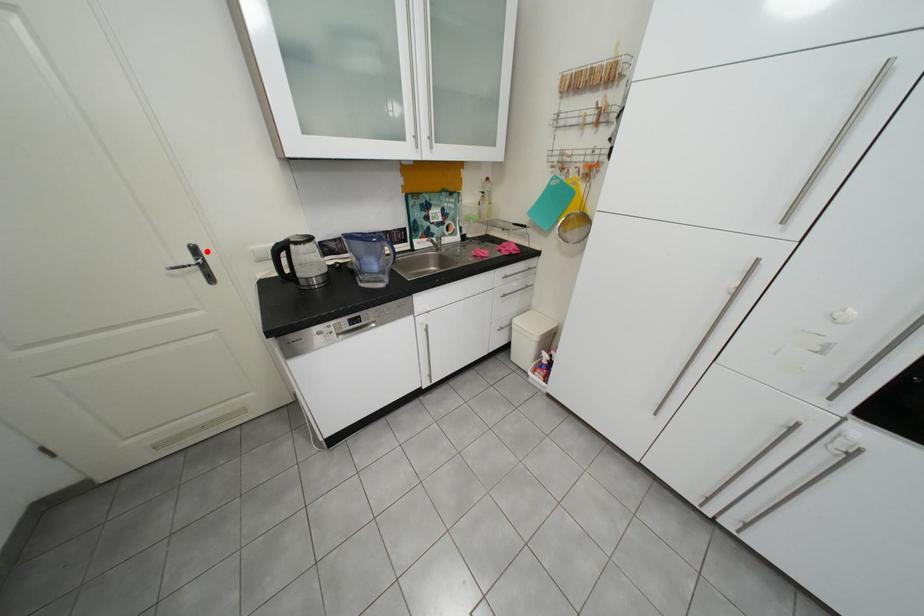
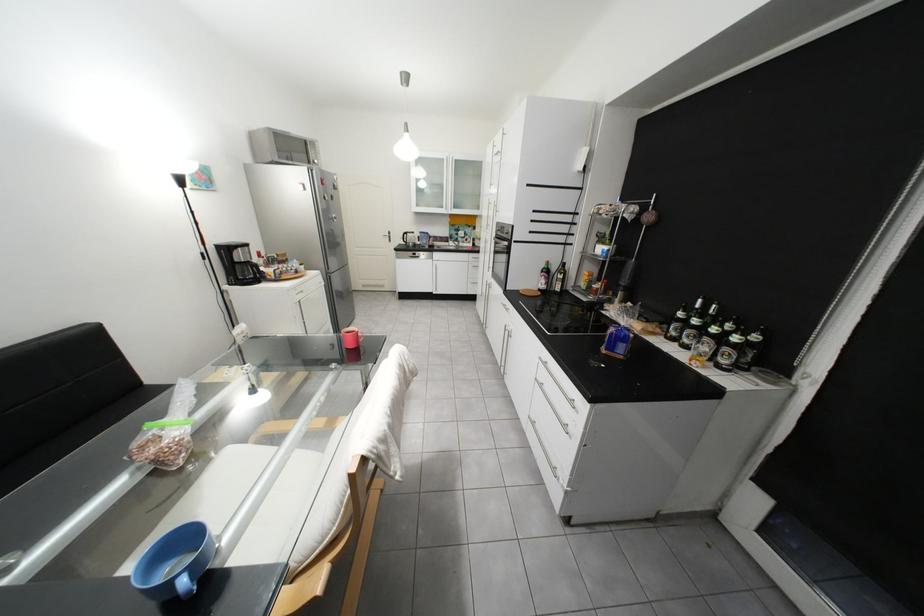
In the second image, find the point that corresponds to the highlighted location in the first image.

(402, 233)